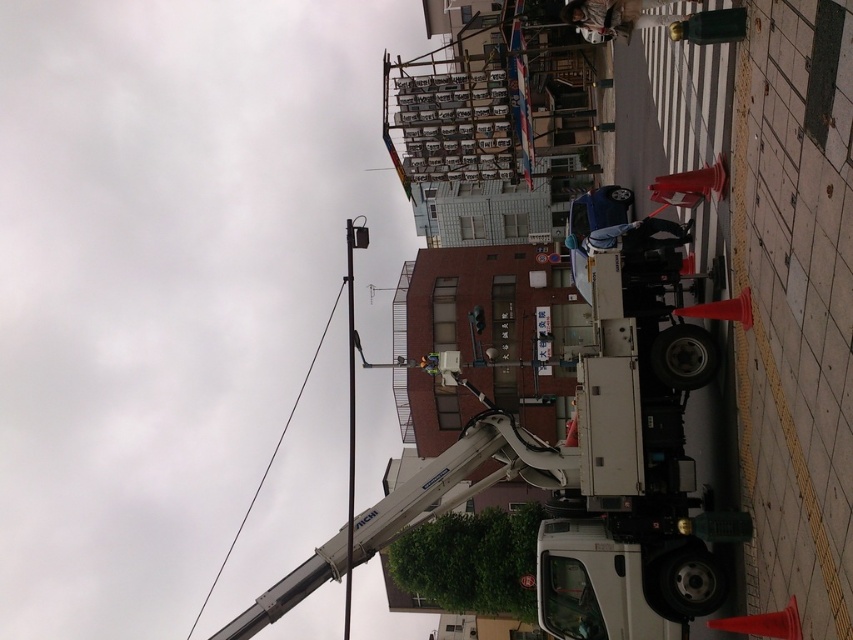
This screenshot has width=853, height=640. Describe the element at coordinates (350, 406) in the screenshot. I see `brushed metal pole at upper center` at that location.

Does point (358, 237) come behind point (311, 371)?

No, (358, 237) is closer to viewer.

The width and height of the screenshot is (853, 640). I want to click on brushed metal pole at upper center, so click(x=350, y=406).

Find the location of a particular element. The height and width of the screenshot is (640, 853). brushed metal pole at upper center is located at coordinates (350, 406).